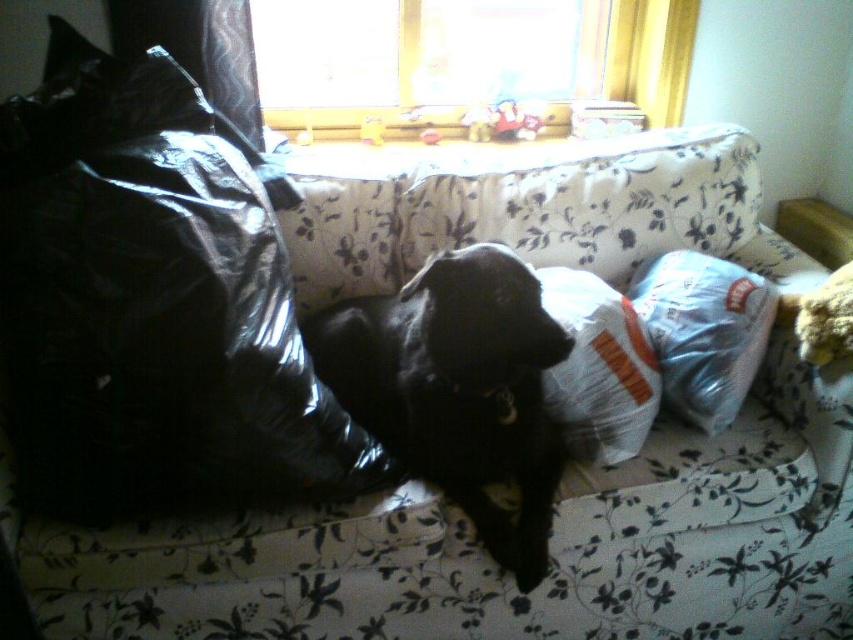
You are a delivery person who just arrived at this house. You need to place a new package that is 1.2 meters tall. Looking at the scene, can the black plastic bag at left or the white fabric pillow at center accommodate this package in terms of height?

The black plastic bag at left is taller than the white fabric pillow at center. However, the package is 1.2 meters tall, and the description does not provide specific measurements for either object. Therefore, it is unclear if either can accommodate the package based on the given information.

You are a guest entering the living room and see the black matte dog at center and the white fabric pillow at right. Which object is closer to you?

The black matte dog at center is closer to you because it is in front of the white fabric pillow at right.